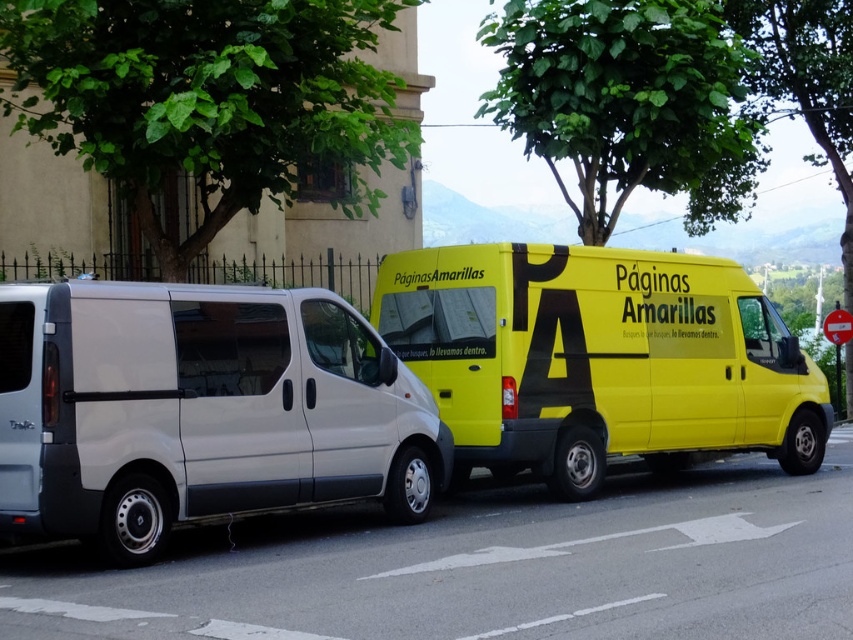
You are a delivery driver who needs to park your vehicle in the same spot as the matte white van at left. What are the coordinates of the parking spot you should aim for?

The coordinates of the parking spot where the matte white van at left is located are at point (199, 412).

You are a delivery driver who needs to park your vehicle between two vans on a narrow road. The space between them is exactly 3 meters wide. You have a delivery van that is 2.8 meters wide. Can you safely park your van between the matte white van at left and the yellow matte van at center without touching either of them?

The matte white van at left is wider than the yellow matte van at center. However, the total width of both vans combined would exceed the 3 meter space available. Therefore, your 2.8 meter wide van should fit safely between them as long as you position it correctly, since the combined width of the two existing vans is greater than 3 meters, leaving enough space for your vehicle.